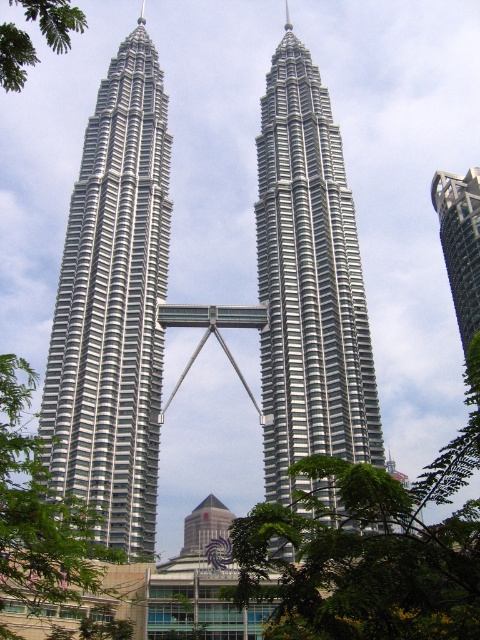
You are standing at the base of the polished steel skyscraper at center. If you want to take a photo of the entire building without moving your camera, what should you do?

You need to move back because the polished steel skyscraper at center is 254.57 feet away from the camera, which may be too far to capture the entire building in one frame without moving the camera.

You are standing at the base of the Petronas Twin Towers and notice two green leafy trees in the image. Which tree is closer to you, the green leafy tree at center or the green leafy tree at upper left?

The green leafy tree at center is closer to you because it is in front of the green leafy tree at upper left.